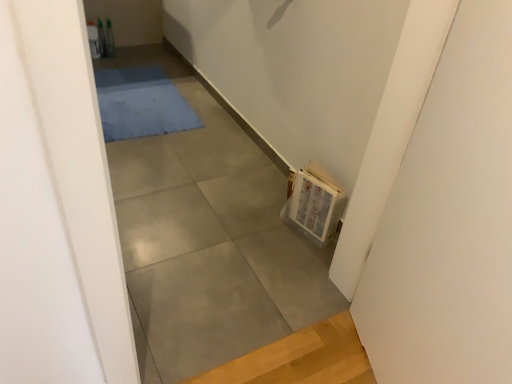
Find the location of `vacant space positioned to the left of wooden frame at right`. vacant space positioned to the left of wooden frame at right is located at coordinates (x=267, y=226).